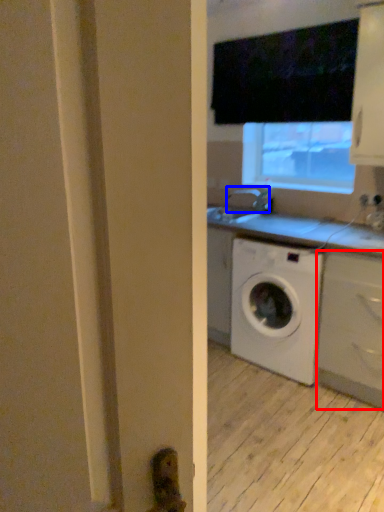
Question: Among these objects, which one is farthest to the camera, cabinetry (highlighted by a red box) or faucet (highlighted by a blue box)?

Choices:
 (A) cabinetry
 (B) faucet

Answer: (B)